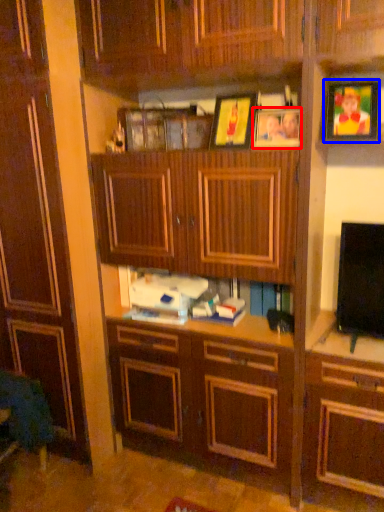
Question: Which of the following is the closest to the observer, picture frame (highlighted by a red box) or picture frame (highlighted by a blue box)?

Choices:
 (A) picture frame
 (B) picture frame

Answer: (B)